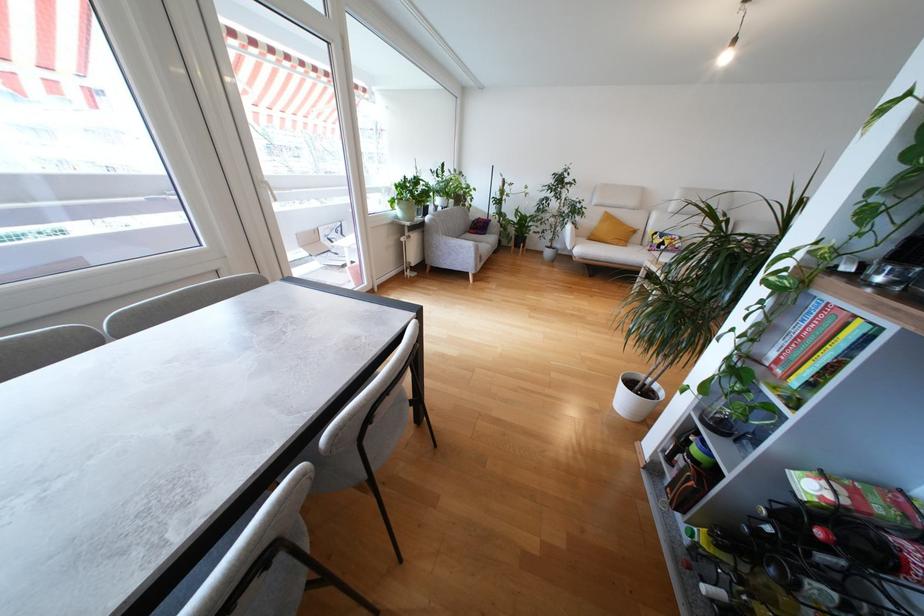
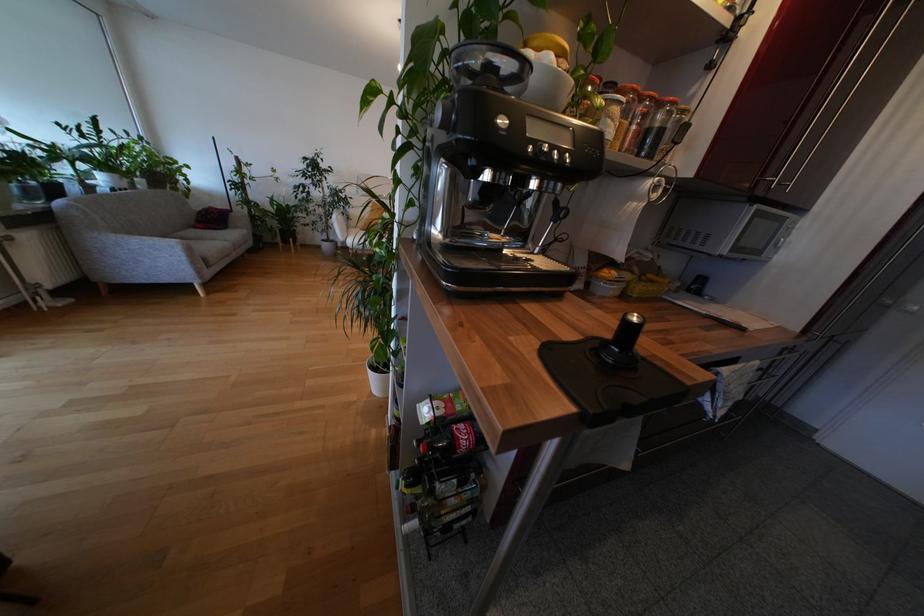
Question: The images are taken continuously from a first-person perspective. In which direction is your viewpoint rotating?

Choices:
 (A) Left
 (B) Right
 (C) Up
 (D) Down

Answer: (B)